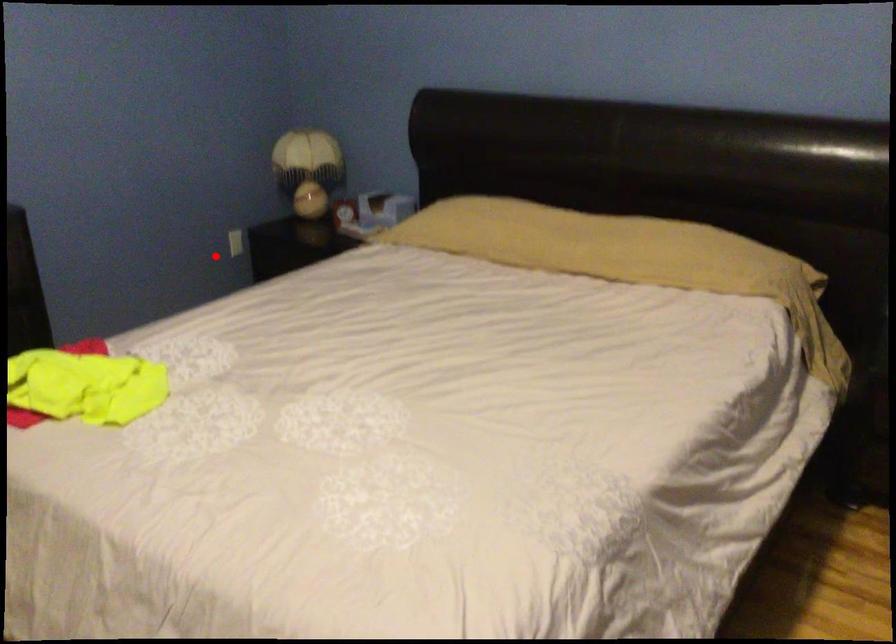
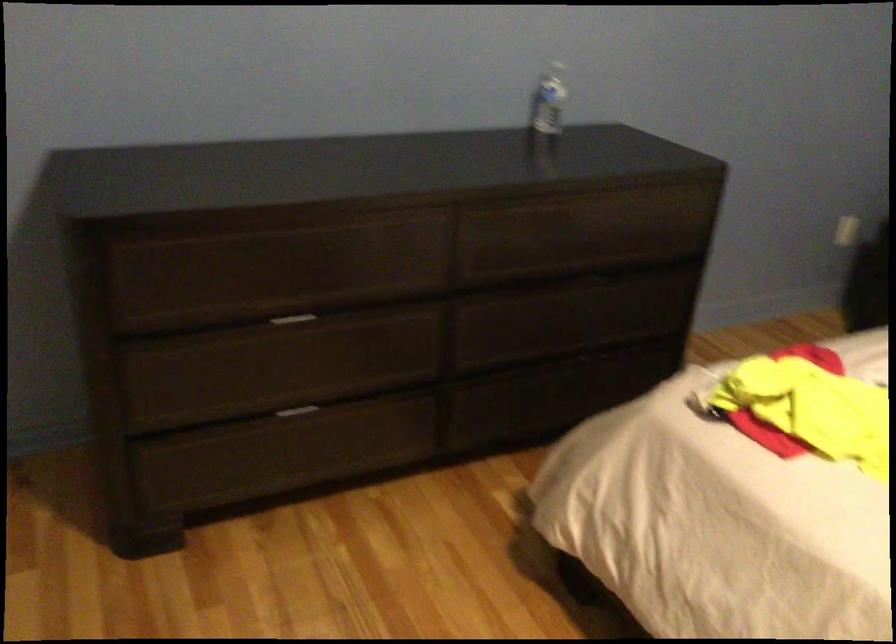
Question: A red point is marked in image1. In image2, is the corresponding 3D point closer to the camera or farther? Reply with the corresponding letter.

Choices:
 (A) The corresponding 3D point is closer.
 (B) The corresponding 3D point is farther.

Answer: (A)